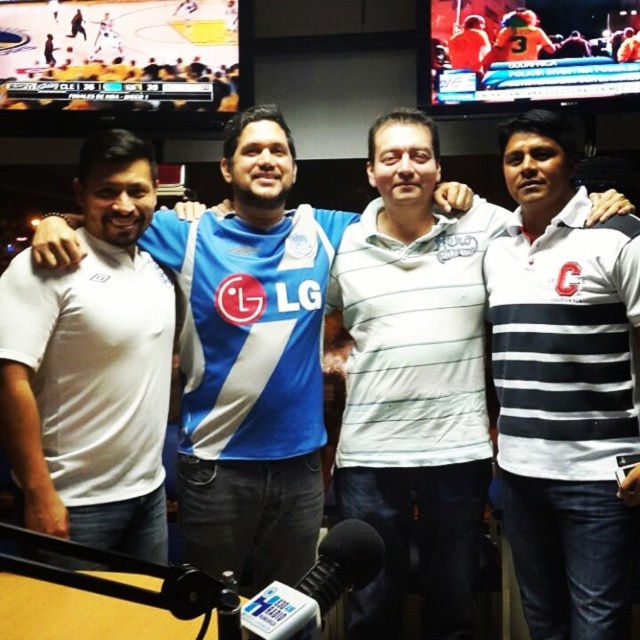
You are a photographer taking a group photo of the four men. You need to ensure that the white striped polo shirt at center and the blue jersey at center are at least 30 inches apart for better visibility. Based on the current arrangement, can you achieve this without moving any of the subjects?

The white striped polo shirt at center is currently 27.64 inches from the blue jersey at center. Since this distance is less than the required 30 inches, you cannot achieve the desired separation without moving the subjects.

In the scene shown: You are standing in front of the group of men in the image. You want to move closer to the point at coordinates point [68,356] and point [344,557]. Which point is closer to you?

Point [68,356] is further to the viewer than point [344,557], so the point [344,557] is closer to you.

You are standing in front of the group of four men and want to take a photo. You notice two points marked in the image at coordinates point (195, 371) and point (97, 529). Which point is closer to your camera?

Point (195, 371) is further to the camera than point (97, 529), so the point closer to your camera is point (97, 529).